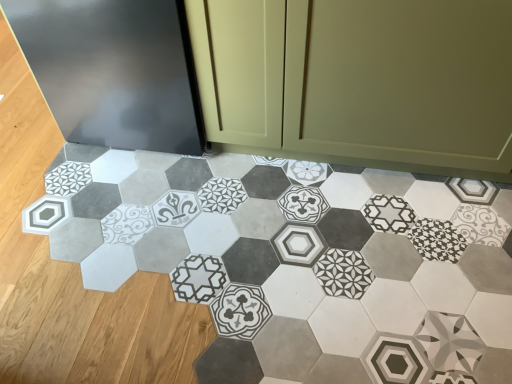
Question: In terms of height, does matte olive green cabinet at center look taller or shorter compared to patterned ceramic tile at center?

Choices:
 (A) tall
 (B) short

Answer: (A)

Question: Considering the positions of point (416, 28) and point (438, 312), is point (416, 28) closer or farther from the camera than point (438, 312)?

Choices:
 (A) closer
 (B) farther

Answer: (A)

Question: From the image's perspective, is matte olive green cabinet at center located above or below patterned ceramic tile at center?

Choices:
 (A) below
 (B) above

Answer: (B)

Question: Is patterned ceramic tile at center wider or thinner than matte olive green cabinet at center?

Choices:
 (A) thin
 (B) wide

Answer: (B)

Question: From the image's perspective, is patterned ceramic tile at center positioned above or below matte olive green cabinet at center?

Choices:
 (A) above
 (B) below

Answer: (B)

Question: Is patterned ceramic tile at center taller or shorter than matte olive green cabinet at center?

Choices:
 (A) tall
 (B) short

Answer: (B)

Question: Based on their sizes in the image, would you say patterned ceramic tile at center is bigger or smaller than matte olive green cabinet at center?

Choices:
 (A) big
 (B) small

Answer: (B)